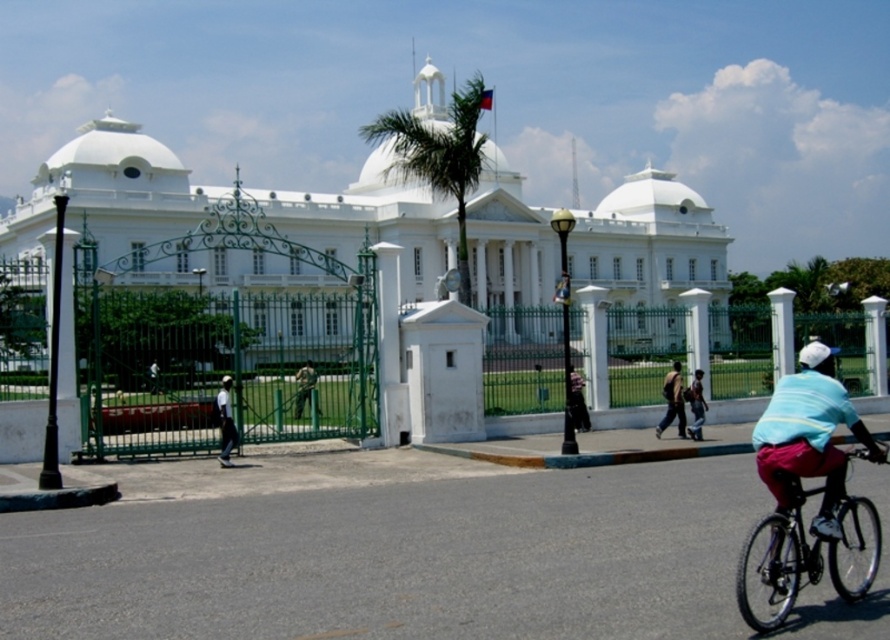
Can you confirm if light blue jersey at center is bigger than dark blue shirt at center?

Yes.

Is point (831, 572) less distant than point (669, 396)?

That is True.

Locate an element on the screen. light blue jersey at center is located at coordinates (808, 442).

Which is below, black matte bicycle at lower right or camouflage fabric jacket at center?

camouflage fabric jacket at center is below.

This screenshot has height=640, width=890. What do you see at coordinates (804, 554) in the screenshot?
I see `black matte bicycle at lower right` at bounding box center [804, 554].

Is point (790, 556) farther from camera compared to point (306, 378)?

No, it is not.

This screenshot has width=890, height=640. What are the coordinates of `black matte bicycle at lower right` in the screenshot? It's located at (804, 554).

Does black matte bicycle at lower right appear under light blue shirt at lower right?

Actually, black matte bicycle at lower right is above light blue shirt at lower right.

Is black matte bicycle at lower right taller than light blue shirt at lower right?

In fact, black matte bicycle at lower right may be shorter than light blue shirt at lower right.

Is point (775, 593) positioned behind point (694, 412)?

No.

At what (x,y) coordinates should I click in order to perform the action: click on black matte bicycle at lower right. Please return your answer as a coordinate pair (x, y). The height and width of the screenshot is (640, 890). Looking at the image, I should click on (804, 554).